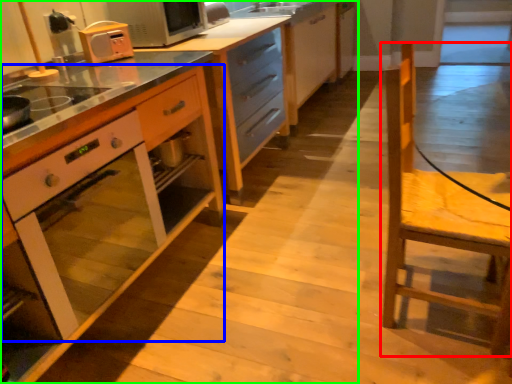
Question: Based on their relative distances, which object is farther from chair (highlighted by a red box)? Choose from oven (highlighted by a blue box) and cabinetry (highlighted by a green box).

Choices:
 (A) oven
 (B) cabinetry

Answer: (B)